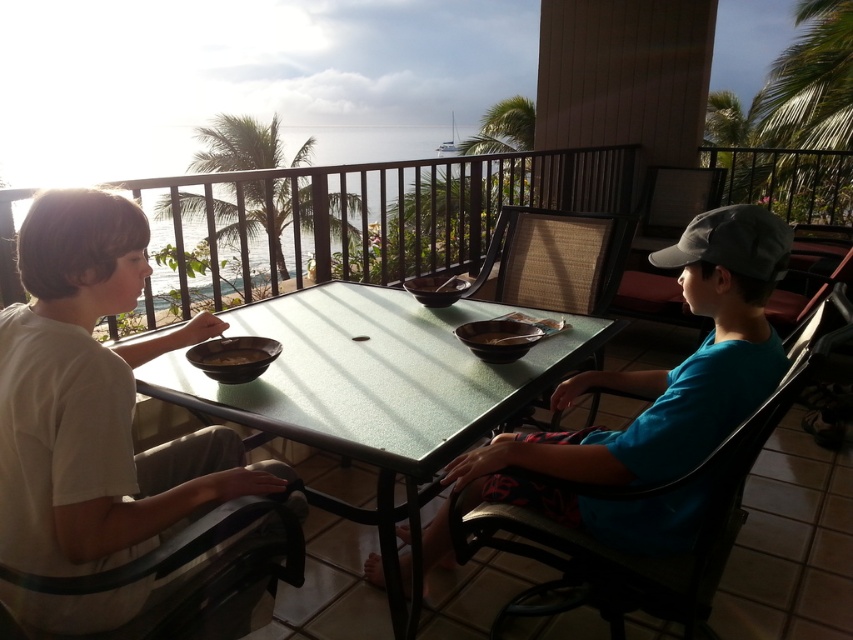
Question: Which point is farther to the camera?

Choices:
 (A) (593, 595)
 (B) (450, 289)
 (C) (248, 355)

Answer: (B)

Question: Which of the following is the closest to the observer?

Choices:
 (A) (138, 372)
 (B) (706, 474)

Answer: (B)

Question: Observing the image, what is the correct spatial positioning of white matte shirt at left in reference to woven wicker chair at center?

Choices:
 (A) below
 (B) above

Answer: (A)

Question: Considering the relative positions of black plastic chair at right and brown matte bowl at center in the image provided, where is black plastic chair at right located with respect to brown matte bowl at center?

Choices:
 (A) above
 (B) below

Answer: (B)

Question: Which point is closer to the camera?

Choices:
 (A) woven wicker chair at center
 (B) white matte shirt at left
 (C) brown matte bowl at center

Answer: (B)

Question: Can you confirm if green matte table at center is smaller than brown matte bowl at left?

Choices:
 (A) yes
 (B) no

Answer: (B)